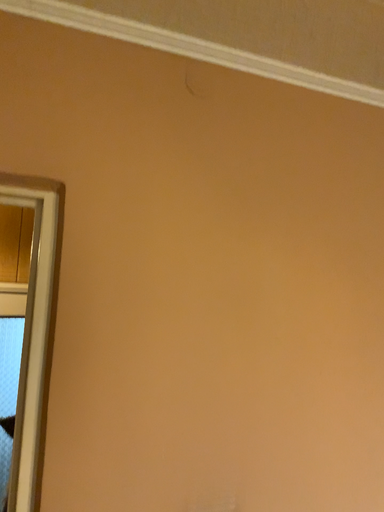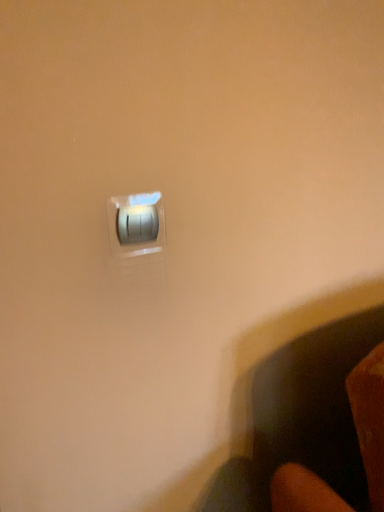
Question: Which way did the camera rotate in the video?

Choices:
 (A) rotated right
 (B) rotated left

Answer: (A)